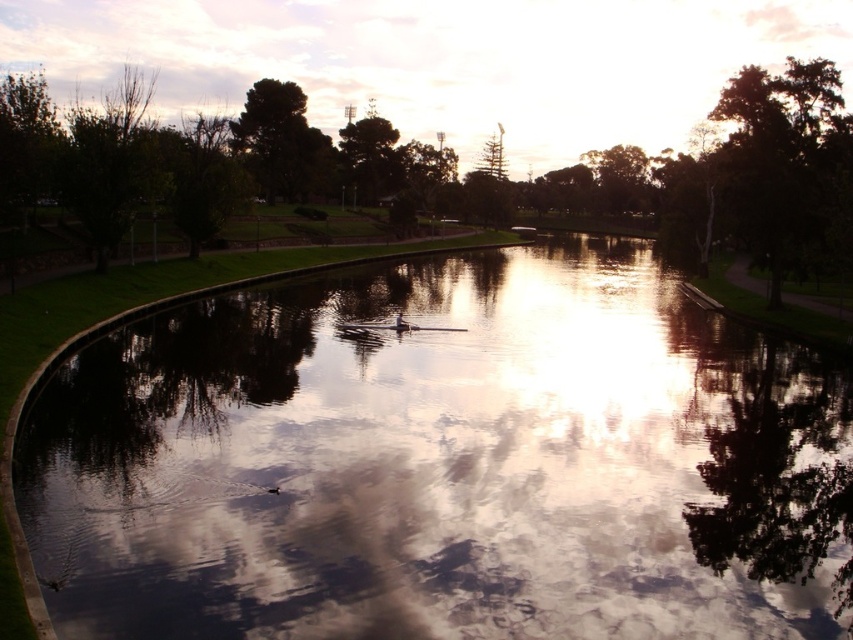
Question: Observing the image, what is the correct spatial positioning of green leafy tree at center in reference to green leafy tree at upper right?

Choices:
 (A) above
 (B) below

Answer: (A)

Question: Estimate the real-world distances between objects in this image. Which object is farther from the green leafy tree at upper right?

Choices:
 (A) glossy reflective water at center
 (B) green leafy tree at center

Answer: (B)

Question: Which object appears closest to the camera in this image?

Choices:
 (A) green leafy tree at upper right
 (B) glossy reflective water at center

Answer: (B)

Question: Does green leafy tree at center have a larger size compared to green leafy tree at upper right?

Choices:
 (A) no
 (B) yes

Answer: (B)

Question: Can you confirm if glossy reflective water at center is thinner than green leafy tree at upper right?

Choices:
 (A) yes
 (B) no

Answer: (B)

Question: Which of the following is the closest to the observer?

Choices:
 (A) (312, 483)
 (B) (807, 93)
 (C) (845, 182)

Answer: (A)